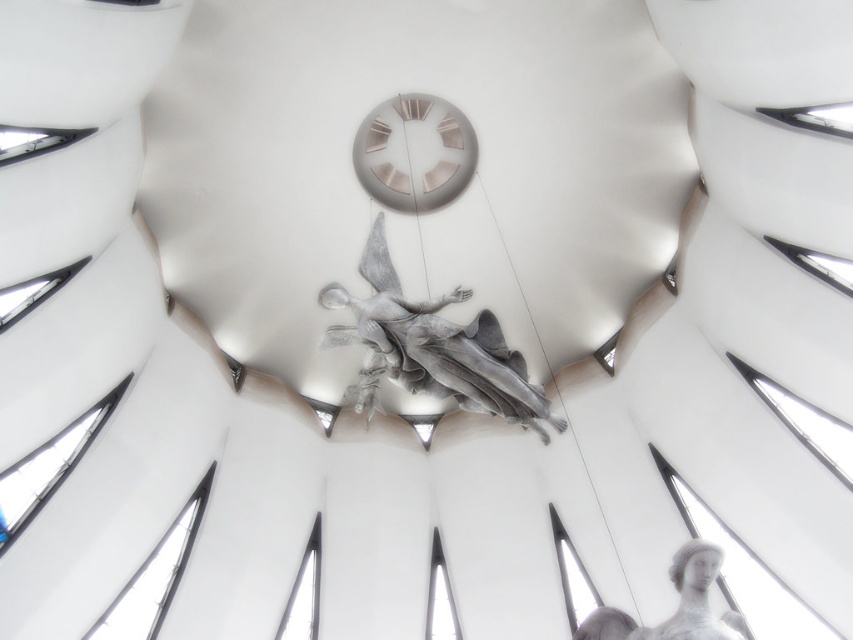
You are an architect analyzing the spatial relationships in the cathedral. Based on the image, is the sculpted silver angel at center positioned higher or lower than the gray stone statue at lower right?

The sculpted silver angel at center is located above the gray stone statue at lower right, so it is positioned higher.

You are an architect visiting this modern structure and notice two metallic elements at the center of the ceiling. The sculpted silver angel at center and the metallic silver clock at center. Which one is positioned higher up?

The metallic silver clock at center is positioned higher up since the sculpted silver angel at center is below it.

You are standing in the modern architectural structure and want to take a photo of both the sculpted silver angel at center and the gray stone statue at lower right. Which direction should you turn to ensure both are visible in your camera frame?

You should turn to your right so that the sculpted silver angel at center, which is to the left of the gray stone statue at lower right, comes into view alongside the statue.